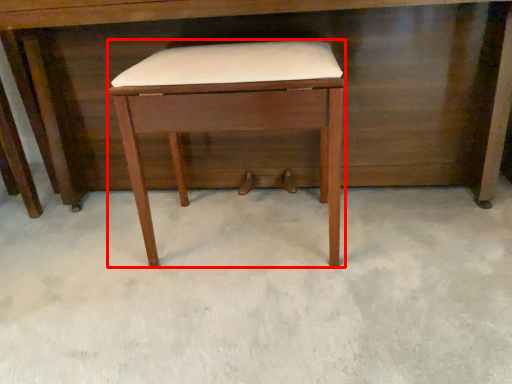
Question: Observing the image, what is the correct spatial positioning of stool (annotated by the red box) in reference to desk?

Choices:
 (A) left
 (B) right

Answer: (A)